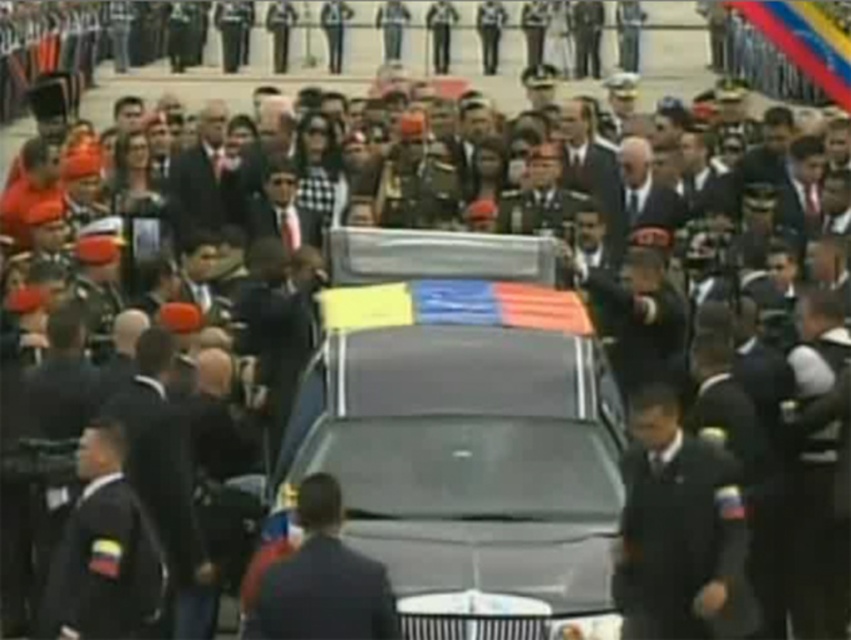
Question: Can you confirm if black uniform at center is positioned to the left of dark gray suit at center?

Choices:
 (A) yes
 (B) no

Answer: (A)

Question: Does black uniform at left have a smaller size compared to black uniform at center?

Choices:
 (A) yes
 (B) no

Answer: (A)

Question: Which object appears closest to the camera in this image?

Choices:
 (A) dark gray suit at center
 (B) dark blue uniform at center
 (C) metallic gray car at center
 (D) polyester flag at center

Answer: (A)

Question: Does dark blue uniform at center appear under dark gray suit at center?

Choices:
 (A) yes
 (B) no

Answer: (B)

Question: Which point is closer to the camera?

Choices:
 (A) black uniform at left
 (B) metallic gray car at center

Answer: (A)

Question: Which point is farther to the camera?

Choices:
 (A) (364, 486)
 (B) (323, 317)
 (C) (332, 493)
 (D) (186, 417)

Answer: (B)